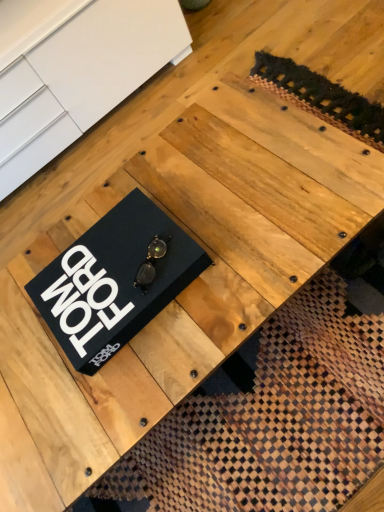
The image size is (384, 512). Describe the element at coordinates (114, 281) in the screenshot. I see `black matte box at center` at that location.

Identify the location of black matte box at center. (114, 281).

The image size is (384, 512). What are the coordinates of `black matte book at center` in the screenshot? It's located at tap(74, 70).

The image size is (384, 512). What do you see at coordinates (74, 70) in the screenshot?
I see `black matte book at center` at bounding box center [74, 70].

The width and height of the screenshot is (384, 512). I want to click on black matte box at center, so click(114, 281).

Which object is positioned more to the right, black matte box at center or black matte book at center?

black matte box at center.

Which is in front, black matte box at center or black matte book at center?

black matte box at center is closer to the camera.

Is point (103, 323) behind point (58, 110)?

No, (103, 323) is closer to viewer.

From the image's perspective, is black matte box at center above or below black matte book at center?

Clearly, from the image's perspective, black matte box at center is below black matte book at center.

From a real-world perspective, which object rests below the other?

black matte book at center is physically lower.

Does black matte box at center have a greater width compared to black matte book at center?

No.

Looking at this image, considering the relative sizes of black matte box at center and black matte book at center in the image provided, is black matte box at center shorter than black matte book at center?

Yes.

In terms of size, does black matte box at center appear bigger or smaller than black matte book at center?

Clearly, black matte box at center is smaller in size than black matte book at center.

Is black matte box at center located outside black matte book at center?

black matte box at center lies outside black matte book at center's area.

Is black matte box at center directly adjacent to black matte book at center?

No, black matte box at center is not next to black matte book at center.

Is black matte box at center aimed at black matte book at center?

No.

How far apart are black matte box at center and black matte book at center?

The distance of black matte box at center from black matte book at center is 35.15 inches.

Where is `plaque on the right of black matte book at center`? This screenshot has height=512, width=384. plaque on the right of black matte book at center is located at coordinates (114, 281).

Looking at this image, is black matte book at center to the left of black matte box at center from the viewer's perspective?

Yes.

Between black matte book at center and black matte box at center, which one is positioned behind?

black matte book at center.

Is point (140, 42) less distant than point (56, 317)?

No, it is not.

From the image's perspective, is black matte book at center on top of black matte box at center?

Yes, from the image's perspective, black matte book at center is on top of black matte box at center.

From a real-world perspective, who is located lower, black matte book at center or black matte box at center?

black matte book at center.

From the picture: Which object is wider, black matte book at center or black matte box at center?

black matte book at center.

Considering the relative sizes of black matte book at center and black matte box at center in the image provided, is black matte book at center taller than black matte box at center?

Yes.

Between black matte book at center and black matte box at center, which one has smaller size?

Smaller between the two is black matte box at center.

Looking at this image, is black matte book at center positioned beyond the bounds of black matte box at center?

Absolutely, black matte book at center is external to black matte box at center.

Is black matte book at center touching black matte box at center?

No, black matte book at center is not in contact with black matte box at center.

Is black matte book at center turned away from black matte box at center?

black matte book at center is not turned away from black matte box at center.

How different are the orientations of black matte book at center and black matte box at center in degrees?

0.0652 degrees separate the facing orientations of black matte book at center and black matte box at center.

Locate an element on the screen. This screenshot has height=512, width=384. furniture on the left of black matte box at center is located at coordinates (74, 70).

I want to click on plaque above the black matte book at center (from a real-world perspective), so pyautogui.click(x=114, y=281).

At what (x,y) coordinates should I click in order to perform the action: click on plaque on the right side of black matte book at center. Please return your answer as a coordinate pair (x, y). The image size is (384, 512). Looking at the image, I should click on (114, 281).